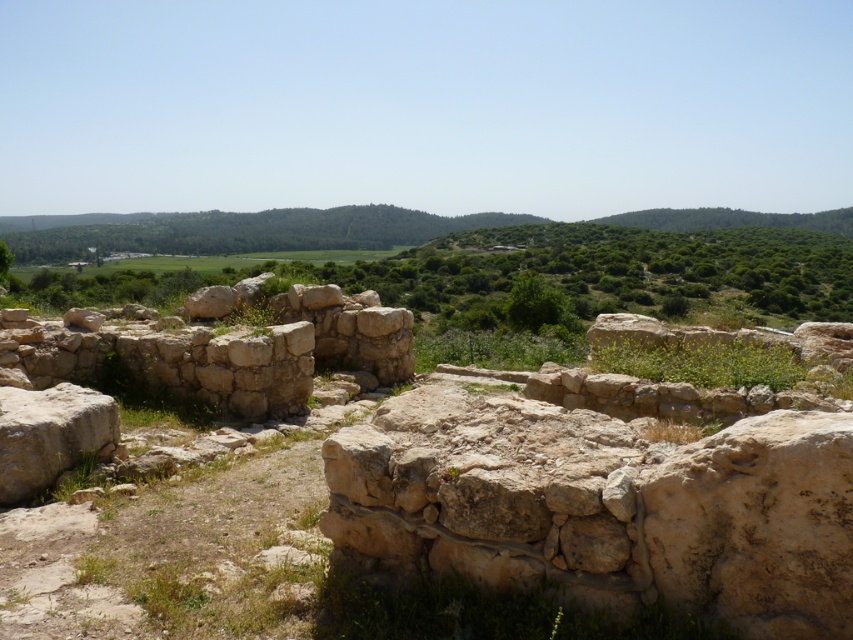
Can you confirm if light beige stone wall at center is positioned to the right of light brown stone boulder at lower left?

Incorrect, light beige stone wall at center is not on the right side of light brown stone boulder at lower left.

Can you confirm if light beige stone wall at center is positioned above light brown stone boulder at lower left?

Yes, light beige stone wall at center is above light brown stone boulder at lower left.

The width and height of the screenshot is (853, 640). What do you see at coordinates (219, 352) in the screenshot?
I see `light beige stone wall at center` at bounding box center [219, 352].

At what (x,y) coordinates should I click in order to perform the action: click on light beige stone wall at center. Please return your answer as a coordinate pair (x, y). The height and width of the screenshot is (640, 853). Looking at the image, I should click on (219, 352).